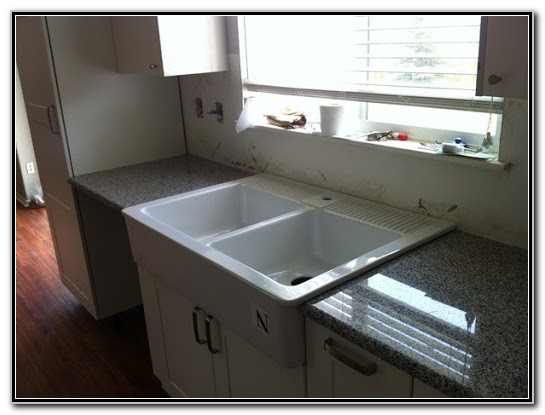
Find the location of a particular element. silver handle is located at coordinates (347, 363).